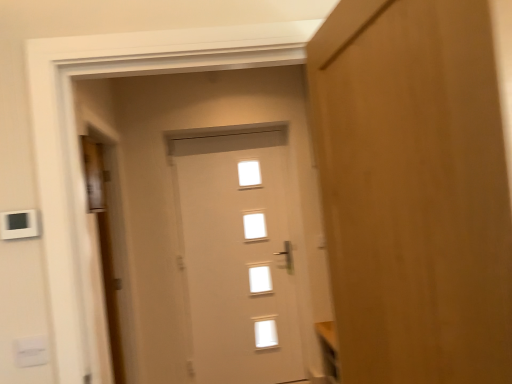
Question: Are white plastic light switch at upper left, the 2th light switch ordered from the bottom, and wooden door at right, which ranks as the first door in right-to-left order, far apart?

Choices:
 (A) no
 (B) yes

Answer: (B)

Question: Is white plastic light switch at upper left, the 2th light switch ordered from the bottom, shorter than wooden door at right, which appears as the 3th door when viewed from the left?

Choices:
 (A) no
 (B) yes

Answer: (B)

Question: Does white plastic light switch at upper left, the 2th light switch ordered from the bottom, turn towards wooden door at right, which is counted as the first door, starting from the front?

Choices:
 (A) no
 (B) yes

Answer: (A)

Question: From the image's perspective, is white plastic light switch at upper left, positioned as the first light switch in top-to-bottom order, beneath wooden door at right, which appears as the 3th door when viewed from the left?

Choices:
 (A) yes
 (B) no

Answer: (A)

Question: Does white plastic light switch at upper left, positioned as the first light switch in top-to-bottom order, have a greater height compared to wooden door at right, which is counted as the first door, starting from the front?

Choices:
 (A) no
 (B) yes

Answer: (A)

Question: From a real-world perspective, relative to wooden door at right, which appears as the 3th door when viewed from the left, is white glossy door at center, which is the 2th door from right to left, vertically above or below?

Choices:
 (A) above
 (B) below

Answer: (B)

Question: Based on their sizes in the image, would you say white glossy door at center, which is counted as the 1th door, starting from the back, is bigger or smaller than wooden door at right, which is counted as the first door, starting from the front?

Choices:
 (A) big
 (B) small

Answer: (A)

Question: Based on their positions, is white glossy door at center, the 2th door viewed from the left, located to the left or right of wooden door at right, the 3th door in the back-to-front sequence?

Choices:
 (A) right
 (B) left

Answer: (B)

Question: Is white glossy door at center, the 2th door viewed from the left, spatially inside wooden door at right, which ranks as the first door in right-to-left order, or outside of it?

Choices:
 (A) inside
 (B) outside

Answer: (B)

Question: From their relative heights in the image, would you say wooden door at left, the second door when ordered from front to back, is taller or shorter than white plastic light switch at lower left, the first light switch when ordered from bottom to top?

Choices:
 (A) short
 (B) tall

Answer: (B)

Question: In the image, is wooden door at left, positioned as the 2th door in back-to-front order, positioned in front of or behind white plastic light switch at lower left, which ranks as the second light switch in top-to-bottom order?

Choices:
 (A) behind
 (B) front

Answer: (A)

Question: In terms of size, does wooden door at left, marked as the third door in a right-to-left arrangement, appear bigger or smaller than white plastic light switch at lower left, the first light switch when ordered from bottom to top?

Choices:
 (A) big
 (B) small

Answer: (A)

Question: Does point (97, 200) appear closer or farther from the camera than point (44, 347)?

Choices:
 (A) farther
 (B) closer

Answer: (A)

Question: In terms of height, does wooden door at right, which appears as the 3th door when viewed from the left, look taller or shorter compared to white plastic light switch at lower left, the first light switch when ordered from bottom to top?

Choices:
 (A) short
 (B) tall

Answer: (B)

Question: From the image's perspective, is wooden door at right, which is counted as the first door, starting from the front, positioned above or below white plastic light switch at lower left, which ranks as the second light switch in top-to-bottom order?

Choices:
 (A) above
 (B) below

Answer: (A)